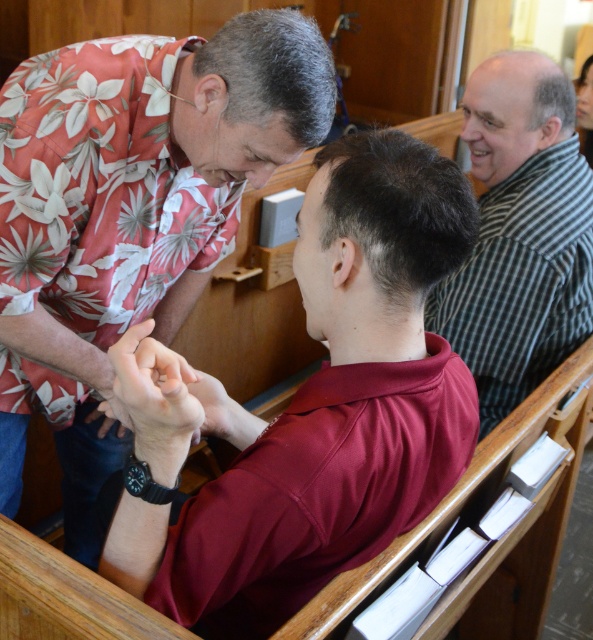
You are an event photographer at a church event. You need to capture a photo of the maroon jersey at center and the striped cotton shirt at upper right in the same frame. Based on their positions, which one is on the left side?

The maroon jersey at center is positioned on the left side of the striped cotton shirt at upper right.

You are an interior designer planning to place a decorative item between the striped cotton shirt at upper right and the smooth skin hand at center. Based on their widths, which object should you consider placing closer to the narrower one?

The striped cotton shirt at upper right might be wider than the smooth skin hand at center, so you should place the decorative item closer to the smooth skin hand at center since it is narrower.